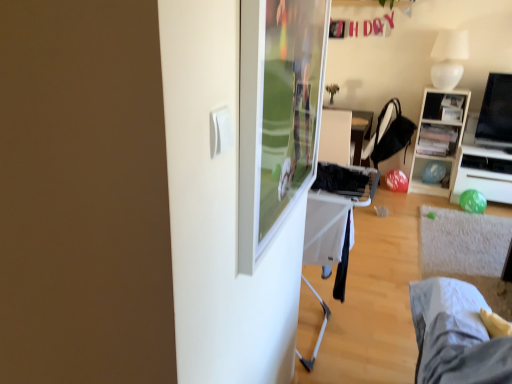
Question: Considering the relative sizes of black glossy tv at right and wooden shelf at right in the image provided, is black glossy tv at right bigger than wooden shelf at right?

Choices:
 (A) no
 (B) yes

Answer: (A)

Question: From the image's perspective, does black glossy tv at right appear lower than wooden shelf at right?

Choices:
 (A) yes
 (B) no

Answer: (B)

Question: Is black glossy tv at right facing towards wooden shelf at right?

Choices:
 (A) yes
 (B) no

Answer: (B)

Question: Can you confirm if black glossy tv at right is smaller than wooden shelf at right?

Choices:
 (A) no
 (B) yes

Answer: (B)

Question: Is black glossy tv at right thinner than wooden shelf at right?

Choices:
 (A) yes
 (B) no

Answer: (A)

Question: Is black glossy tv at right next to wooden shelf at right?

Choices:
 (A) no
 (B) yes

Answer: (A)

Question: Can you confirm if black fabric chair at center is positioned to the left of white fabric bed at lower right?

Choices:
 (A) no
 (B) yes

Answer: (A)

Question: Can you see black fabric chair at center touching white fabric bed at lower right?

Choices:
 (A) no
 (B) yes

Answer: (A)

Question: From a real-world perspective, is black fabric chair at center on white fabric bed at lower right?

Choices:
 (A) no
 (B) yes

Answer: (B)

Question: Is there a large distance between black fabric chair at center and white fabric bed at lower right?

Choices:
 (A) no
 (B) yes

Answer: (B)

Question: Is white fabric bed at lower right at the back of black fabric chair at center?

Choices:
 (A) no
 (B) yes

Answer: (A)

Question: Is black fabric chair at center at the right side of white fabric bed at lower right?

Choices:
 (A) no
 (B) yes

Answer: (B)

Question: Does black fabric chair at center have a smaller size compared to wooden shelf at upper right?

Choices:
 (A) no
 (B) yes

Answer: (A)